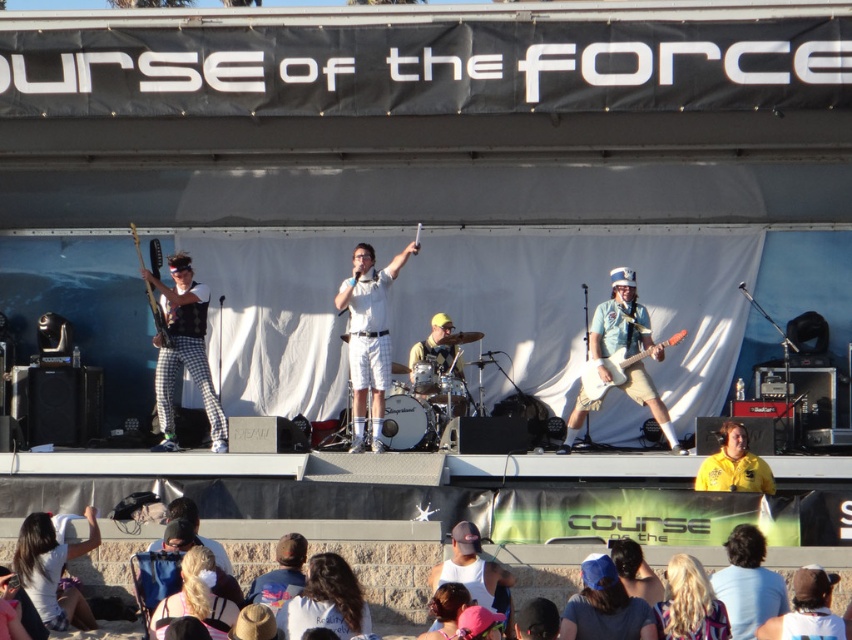
Question: Considering the relative positions of blue fabric cap at center and blonde hair at lower right in the image provided, where is blue fabric cap at center located with respect to blonde hair at lower right?

Choices:
 (A) left
 (B) right

Answer: (A)

Question: Which point is closer to the camera?

Choices:
 (A) (611, 356)
 (B) (196, 577)
 (C) (654, 417)

Answer: (B)

Question: Which point is closer to the camera?

Choices:
 (A) (570, 413)
 (B) (737, 468)

Answer: (B)

Question: Which point is farther to the camera?

Choices:
 (A) yellow shirt at center
 (B) wooden electric guitar at center
 (C) white matte guitar at center
 (D) white cotton shirt at lower left

Answer: (B)

Question: Can you confirm if white matte guitar at center is positioned to the right of matte black guitar at left?

Choices:
 (A) yes
 (B) no

Answer: (A)

Question: Does white cotton shirt at lower center appear over dark brown leather hat at lower center?

Choices:
 (A) yes
 (B) no

Answer: (B)